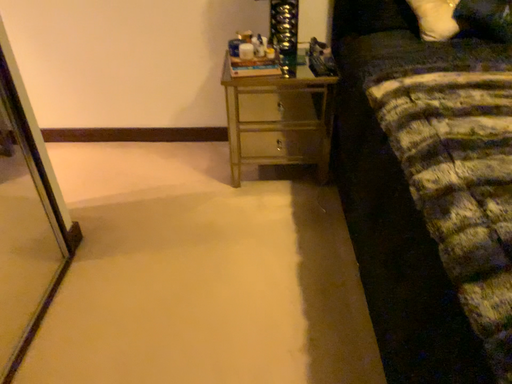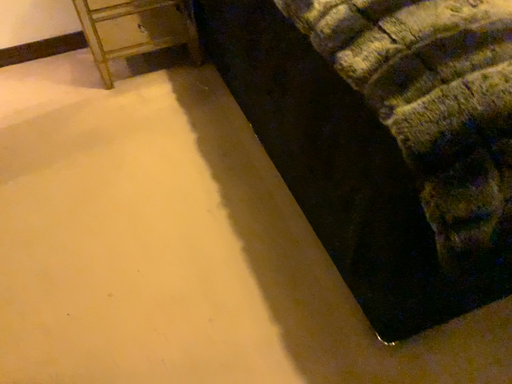
Question: How did the camera likely rotate when shooting the video?

Choices:
 (A) rotated left
 (B) rotated right

Answer: (B)